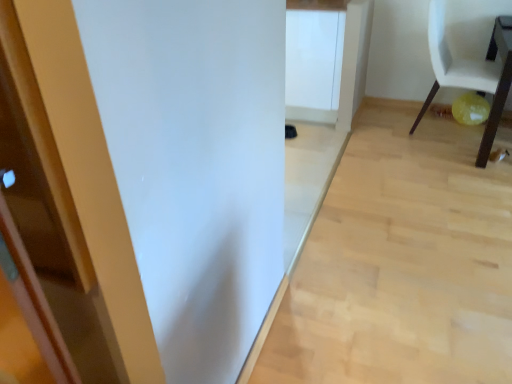
You are a GUI agent. You are given a task and a screenshot of the screen. Output one action in this format:
    pyautogui.click(x=<x>, y=<y>)
    Task: Click on the free location in front of white matte chair at right
    
    Given the screenshot: What is the action you would take?
    pyautogui.click(x=449, y=158)